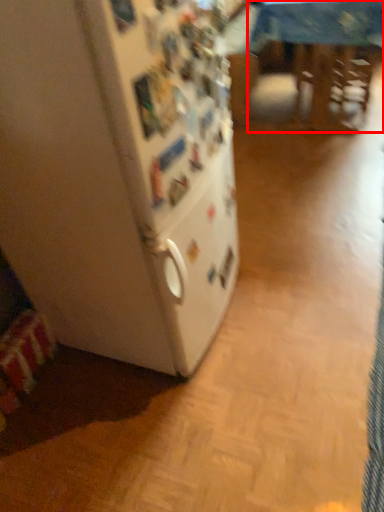
Question: Observing the image, what is the correct spatial positioning of table (annotated by the red box) in reference to refrigerator?

Choices:
 (A) right
 (B) left

Answer: (A)